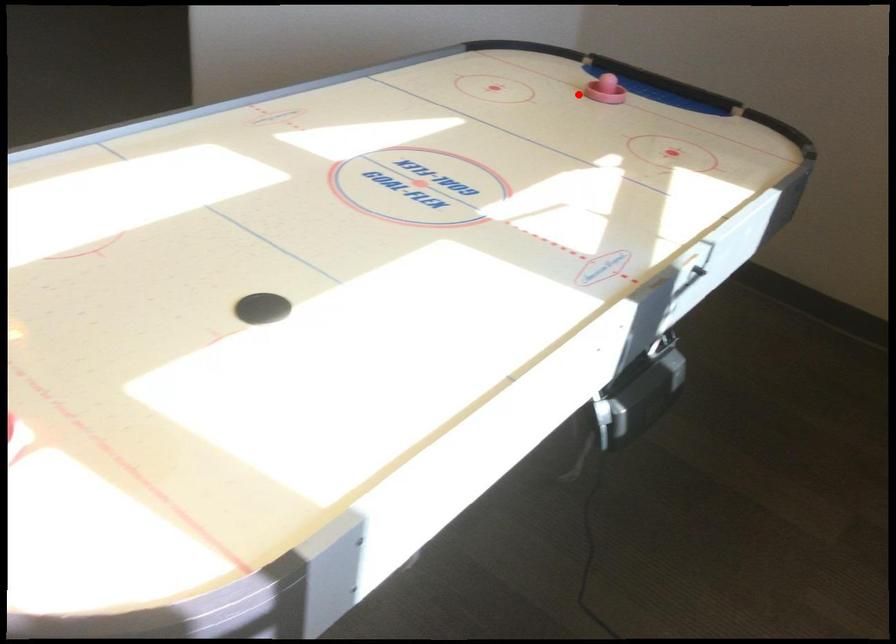
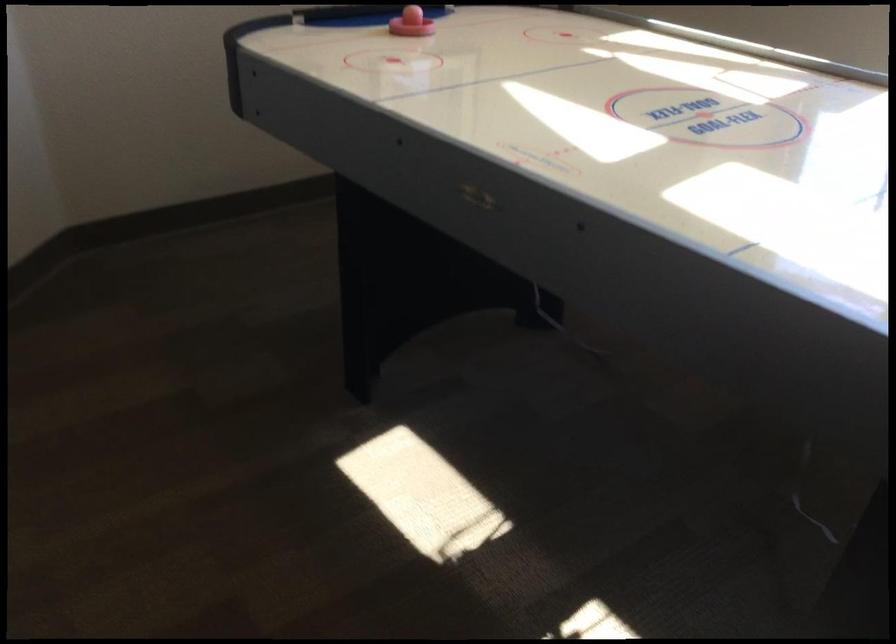
Question: I am providing you with two images of the same scene from different viewpoints. Image1 has a red point marked. In image2, the corresponding 3D location appears at what relative position? Reply with the corresponding letter.

Choices:
 (A) Closer
 (B) Farther

Answer: (A)